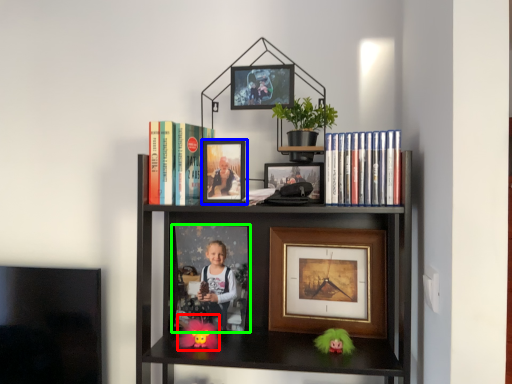
Question: Considering the real-world distances, which object is closest to toy (highlighted by a red box)? picture frame (highlighted by a blue box) or picture frame (highlighted by a green box).

Choices:
 (A) picture frame
 (B) picture frame

Answer: (B)